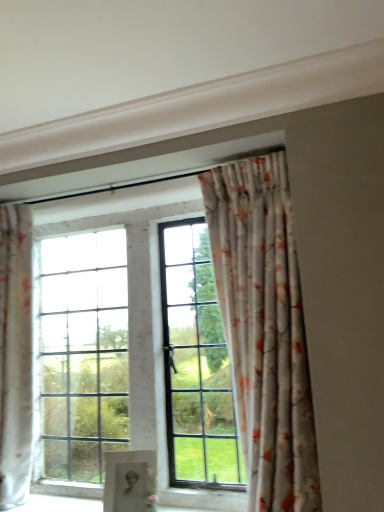
Question: Is floral fabric curtain at upper center, arranged as the 2th curtain when viewed from the left, in front of or behind matte black portrait at center in the image?

Choices:
 (A) front
 (B) behind

Answer: (A)

Question: Would you say floral fabric curtain at upper center, arranged as the 2th curtain when viewed from the left, is inside or outside matte black portrait at center?

Choices:
 (A) inside
 (B) outside

Answer: (B)

Question: Estimate the real-world distances between objects in this image. Which object is closer to the matte black portrait at center?

Choices:
 (A) floral fabric curtain at left, arranged as the 1th curtain when viewed from the left
 (B) white glossy wood at lower center
 (C) floral fabric curtain at upper center, arranged as the 2th curtain when viewed from the left

Answer: (B)

Question: Which object is the farthest from the floral fabric curtain at left, arranged as the 1th curtain when viewed from the left?

Choices:
 (A) matte black portrait at center
 (B) white glossy wood at lower center
 (C) floral fabric curtain at upper center, the first curtain viewed from the right

Answer: (C)